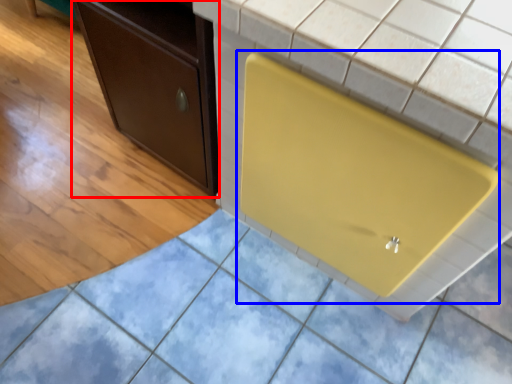
Question: Which object is closer to the camera taking this photo, cabinetry (highlighted by a red box) or appliance (highlighted by a blue box)?

Choices:
 (A) cabinetry
 (B) appliance

Answer: (B)